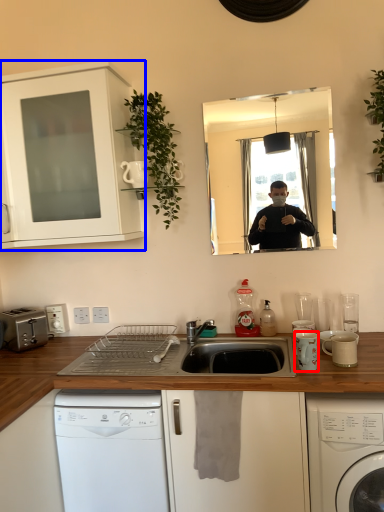
Question: Which object appears farthest to the camera in this image, appliance (highlighted by a red box) or cabinetry (highlighted by a blue box)?

Choices:
 (A) appliance
 (B) cabinetry

Answer: (B)